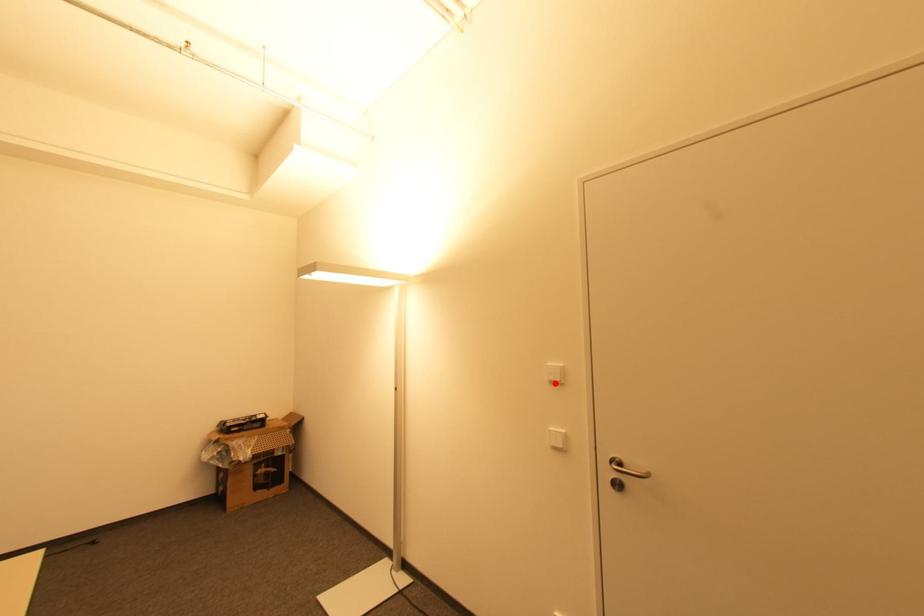
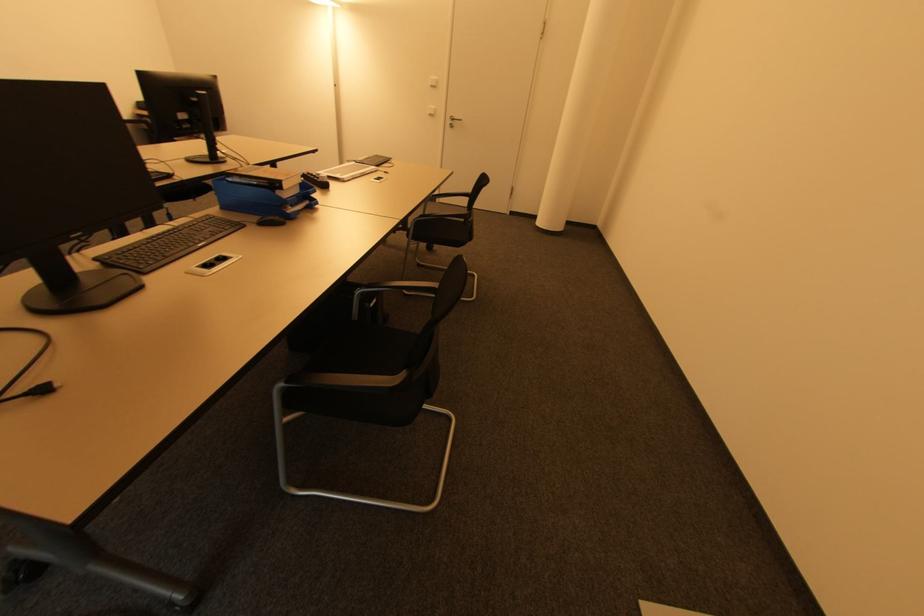
Question: I am providing you with two images of the same scene from different viewpoints. In image1, a red point is highlighted. Considering the same 3D point in image2, which of the following is correct?

Choices:
 (A) It is closer
 (B) It is farther

Answer: (A)